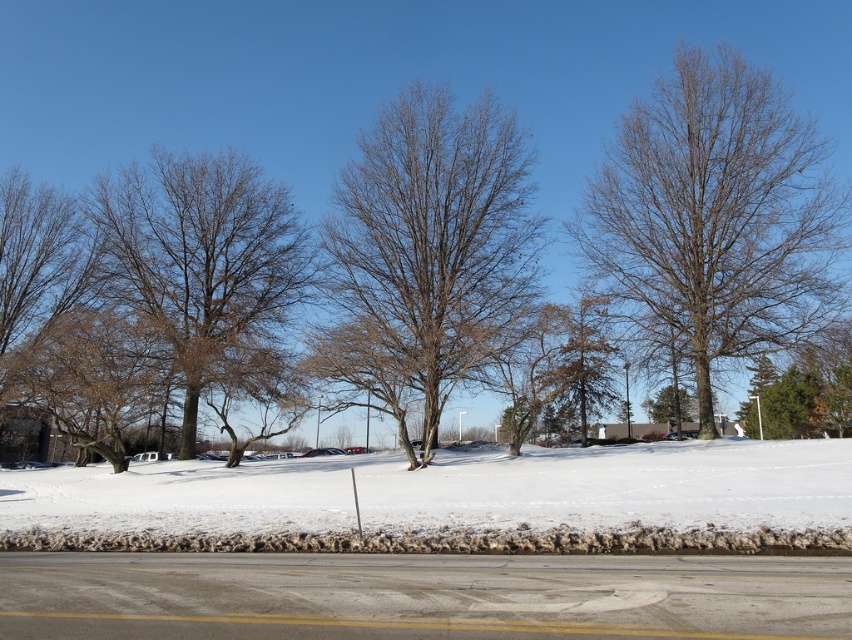
Question: Observing the image, what is the correct spatial positioning of white powdery snow at center in reference to bare branches at upper right?

Choices:
 (A) right
 (B) left

Answer: (B)

Question: Does bare branches at center have a greater width compared to bare brown tree at left?

Choices:
 (A) yes
 (B) no

Answer: (B)

Question: Does white powdery snow at center have a smaller size compared to bare branches at center?

Choices:
 (A) yes
 (B) no

Answer: (A)

Question: Among these objects, which one is nearest to the camera?

Choices:
 (A) green leafy tree at center
 (B) bare branches at center
 (C) white powdery snow at center

Answer: (C)

Question: Among these points, which one is nearest to the camera?

Choices:
 (A) (475, 129)
 (B) (183, 294)
 (C) (711, 328)

Answer: (C)

Question: Which point is farther from the camera taking this photo?

Choices:
 (A) (355, 176)
 (B) (119, 541)

Answer: (A)